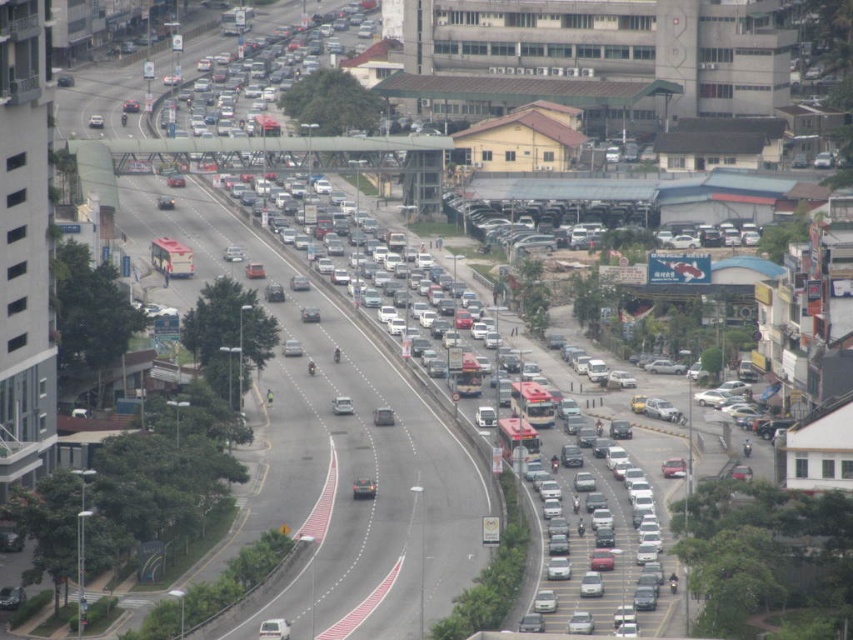
You are a drone operator trying to capture a photo of the metallic gray highway at center. Your drone is currently hovering at point (334, 442). Is your drone currently above the metallic gray highway at center?

Yes, the point (334, 442) corresponds to the metallic gray highway at center, so the drone is currently above the metallic gray highway at center.

You are a driver approaching the metallic gray highway at center and see the silver metallic car at center ahead. Which direction should you turn to avoid the car?

You should turn to your right to avoid the silver metallic car at center because the metallic gray highway at center is to the left of the car, indicating the car is on your left side.